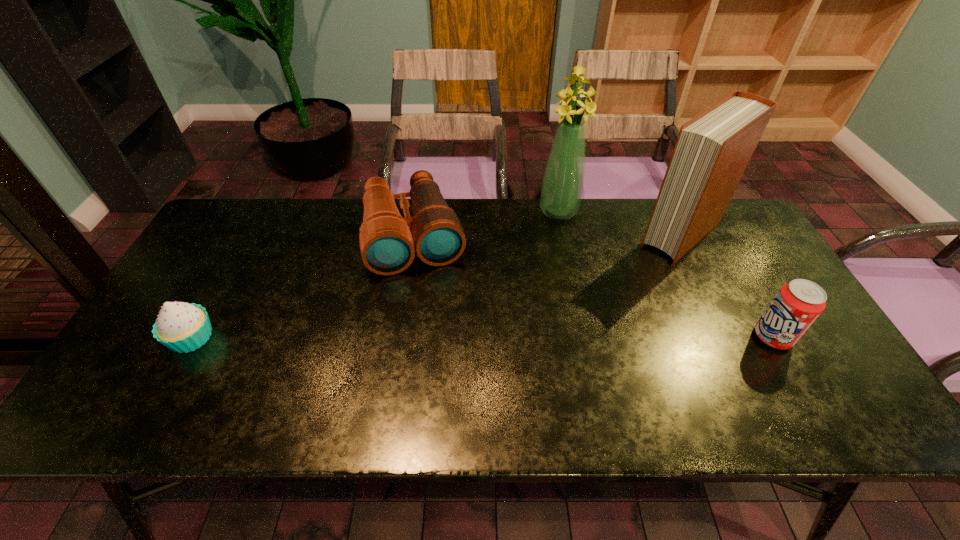
Where is `empty location between the binoculars and the soda can`? The width and height of the screenshot is (960, 540). empty location between the binoculars and the soda can is located at coordinates (593, 286).

Find the location of `vacant area that lies between the bouquet and the second tallest object`. vacant area that lies between the bouquet and the second tallest object is located at coordinates coord(620,224).

Choose which object is the fourth nearest neighbor to the third object from right to left. Please provide its 2D coordinates. Your answer should be formatted as a tuple, i.e. [(x, y)], where the tuple contains the x and y coordinates of a point satisfying the conditions above.

[(182, 327)]

Identify which object is located as the third nearest to the soda can. Please provide its 2D coordinates. Your answer should be formatted as a tuple, i.e. [(x, y)], where the tuple contains the x and y coordinates of a point satisfying the conditions above.

[(386, 244)]

You are a GUI agent. You are given a task and a screenshot of the screen. Output one action in this format:
    pyautogui.click(x=<x>, y=<y>)
    Task: Click on the vacant space that satisfies the following two spatial constraints: 1. on the front side of the soda can; 2. on the surface of the fourth shortest object
    This screenshot has height=540, width=960.
    Given the screenshot: What is the action you would take?
    pyautogui.click(x=731, y=337)

Where is `free space in the image that satisfies the following two spatial constraints: 1. on the back side of the cupcake; 2. on the left side of the hardback book`? free space in the image that satisfies the following two spatial constraints: 1. on the back side of the cupcake; 2. on the left side of the hardback book is located at coordinates (250, 235).